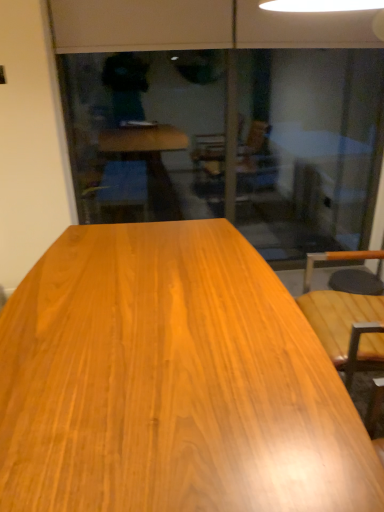
Locate an element on the screen. This screenshot has width=384, height=512. glossy wood table at center is located at coordinates (171, 382).

The width and height of the screenshot is (384, 512). What do you see at coordinates (171, 382) in the screenshot?
I see `glossy wood table at center` at bounding box center [171, 382].

In order to click on transparent glass screen door at center in this screenshot , I will do `click(308, 148)`.

Image resolution: width=384 pixels, height=512 pixels. What do you see at coordinates (308, 148) in the screenshot?
I see `transparent glass screen door at center` at bounding box center [308, 148].

I want to click on glossy wood table at center, so click(x=171, y=382).

Visually, is glossy wood table at center positioned to the left or to the right of transparent glass screen door at center?

glossy wood table at center is to the left of transparent glass screen door at center.

Is glossy wood table at center positioned in front of transparent glass screen door at center?

Yes.

Considering the positions of point (120, 361) and point (87, 91), is point (120, 361) closer or farther from the camera than point (87, 91)?

Point (120, 361).

From the image's perspective, between glossy wood table at center and transparent glass screen door at center, which one is located above?

From the image's view, transparent glass screen door at center is above.

In the scene shown: From a real-world perspective, between glossy wood table at center and transparent glass screen door at center, who is vertically higher?

transparent glass screen door at center.

Consider the image. Between glossy wood table at center and transparent glass screen door at center, which one has smaller width?

With smaller width is transparent glass screen door at center.

Which of these two, glossy wood table at center or transparent glass screen door at center, stands shorter?

glossy wood table at center is shorter.

Does glossy wood table at center have a larger size compared to transparent glass screen door at center?

Yes, glossy wood table at center is bigger than transparent glass screen door at center.

Which is correct: glossy wood table at center is inside transparent glass screen door at center, or outside of it?

glossy wood table at center is located beyond the bounds of transparent glass screen door at center.

Is glossy wood table at center far away from transparent glass screen door at center?

Yes, glossy wood table at center is far from transparent glass screen door at center.

Is glossy wood table at center facing towards transparent glass screen door at center?

No, glossy wood table at center is not turned towards transparent glass screen door at center.

What are the coordinates of `screen door above the glossy wood table at center (from the image's perspective)` in the screenshot? It's located at (308, 148).

Which object is positioned more to the left, transparent glass screen door at center or glossy wood table at center?

Positioned to the left is glossy wood table at center.

Relative to glossy wood table at center, is transparent glass screen door at center in front or behind?

In the image, transparent glass screen door at center appears behind glossy wood table at center.

Does point (259, 216) come farther from viewer compared to point (202, 370)?

That is True.

Based on the photo, from the image's perspective, relative to glossy wood table at center, is transparent glass screen door at center above or below?

Based on their image positions, transparent glass screen door at center is located above glossy wood table at center.

From a real-world perspective, between transparent glass screen door at center and glossy wood table at center, who is vertically lower?

glossy wood table at center, from a real-world perspective.

Considering the relative sizes of transparent glass screen door at center and glossy wood table at center in the image provided, is transparent glass screen door at center wider than glossy wood table at center?

In fact, transparent glass screen door at center might be narrower than glossy wood table at center.

Does transparent glass screen door at center have a lesser height compared to glossy wood table at center?

No.

Can you confirm if transparent glass screen door at center is bigger than glossy wood table at center?

Actually, transparent glass screen door at center might be smaller than glossy wood table at center.

Would you say transparent glass screen door at center contains glossy wood table at center?

Actually, glossy wood table at center is outside transparent glass screen door at center.

In the scene shown: Is transparent glass screen door at center not near glossy wood table at center?

Yes, transparent glass screen door at center is far from glossy wood table at center.

Does transparent glass screen door at center turn towards glossy wood table at center?

Yes, transparent glass screen door at center faces towards glossy wood table at center.

From the picture: How distant is transparent glass screen door at center from glossy wood table at center?

transparent glass screen door at center and glossy wood table at center are 2.33 meters apart from each other.

At what (x,y) coordinates should I click in order to perform the action: click on screen door above the glossy wood table at center (from a real-world perspective). Please return your answer as a coordinate pair (x, y). The width and height of the screenshot is (384, 512). Looking at the image, I should click on (308, 148).

The image size is (384, 512). Identify the location of table located on the left of transparent glass screen door at center. (171, 382).

Identify the location of table lying below the transparent glass screen door at center (from the image's perspective). This screenshot has width=384, height=512. (171, 382).